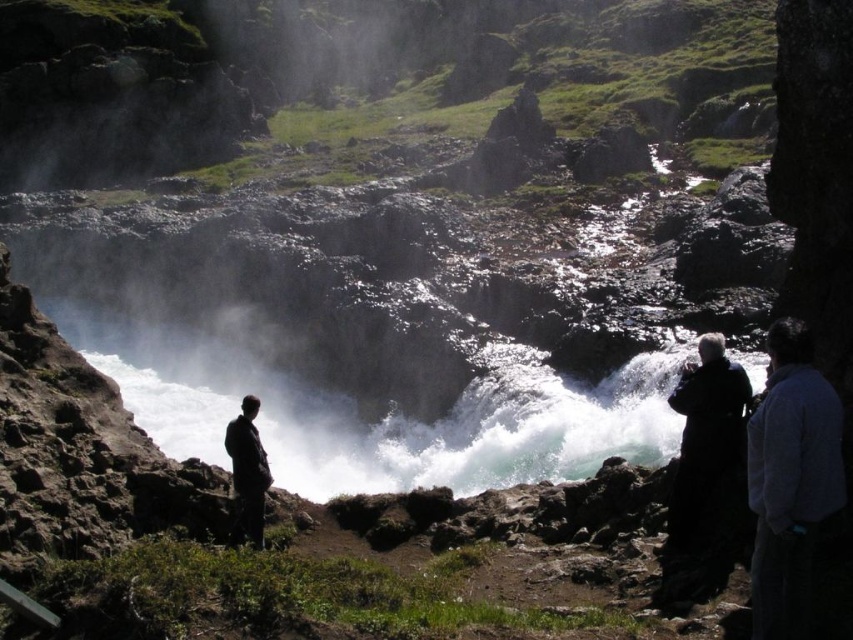
Is point (750, 464) closer to viewer compared to point (233, 454)?

Yes, point (750, 464) is in front of point (233, 454).

Which is in front, point (782, 497) or point (234, 442)?

Point (782, 497) is more forward.

Locate an element on the screen. The image size is (853, 640). dark blue fleece jacket at right is located at coordinates tap(790, 481).

Who is higher up, dark blue fleece jacket at right or black matte coat at right?

Positioned higher is black matte coat at right.

How far apart are dark blue fleece jacket at right and black matte coat at right?

A distance of 3.52 meters exists between dark blue fleece jacket at right and black matte coat at right.

Looking at this image, who is more forward, (753, 573) or (738, 380)?

Point (753, 573) is more forward.

You are a GUI agent. You are given a task and a screenshot of the screen. Output one action in this format:
    pyautogui.click(x=<x>, y=<y>)
    Task: Click on the dark blue fleece jacket at right
    
    Given the screenshot: What is the action you would take?
    pyautogui.click(x=790, y=481)

Does black matte coat at right have a lesser height compared to dark gray suit at lower left?

No.

Identify the location of black matte coat at right. (703, 458).

Does point (665, 577) come farther from viewer compared to point (238, 534)?

That is False.

Image resolution: width=853 pixels, height=640 pixels. Find the location of `black matte coat at right`. black matte coat at right is located at coordinates tap(703, 458).